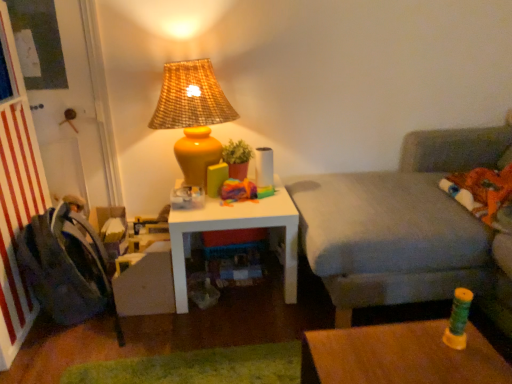
The image size is (512, 384). Find the location of `empty space that is ontop of white matte table at center (from a real-world perspective)`. empty space that is ontop of white matte table at center (from a real-world perspective) is located at coordinates (224, 199).